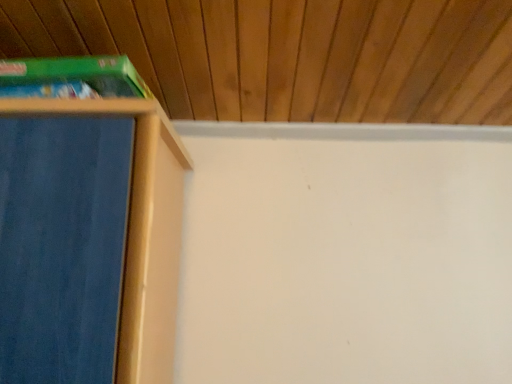
The image size is (512, 384). What do you see at coordinates (71, 78) in the screenshot? I see `green matte book at upper left` at bounding box center [71, 78].

Locate an element on the screen. The image size is (512, 384). green matte book at upper left is located at coordinates (71, 78).

Measure the distance between green matte book at upper left and camera.

The distance of green matte book at upper left from camera is 29.15 inches.

The image size is (512, 384). In order to click on green matte book at upper left in this screenshot , I will do `click(71, 78)`.